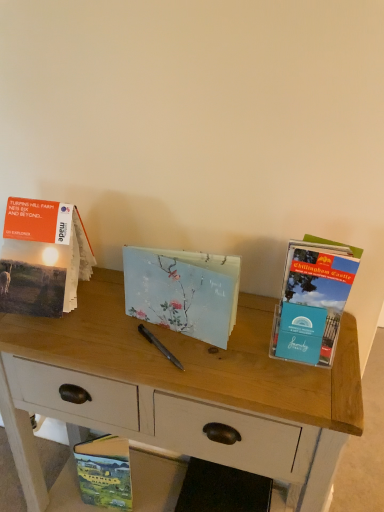
Image resolution: width=384 pixels, height=512 pixels. What are the coordinates of `vacant space situated on the left part of light blue textured notebook at center, which is the 3th book from bottom to top` in the screenshot? It's located at (104, 335).